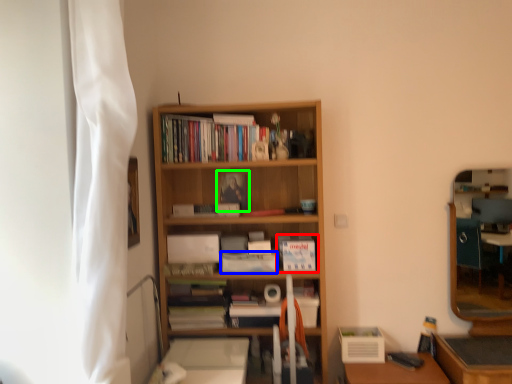
Question: Estimate the real-world distances between objects in this image. Which object is closer to book (highlighted by a red box), paperback book (highlighted by a blue box) or paperback book (highlighted by a green box)?

Choices:
 (A) paperback book
 (B) paperback book

Answer: (A)